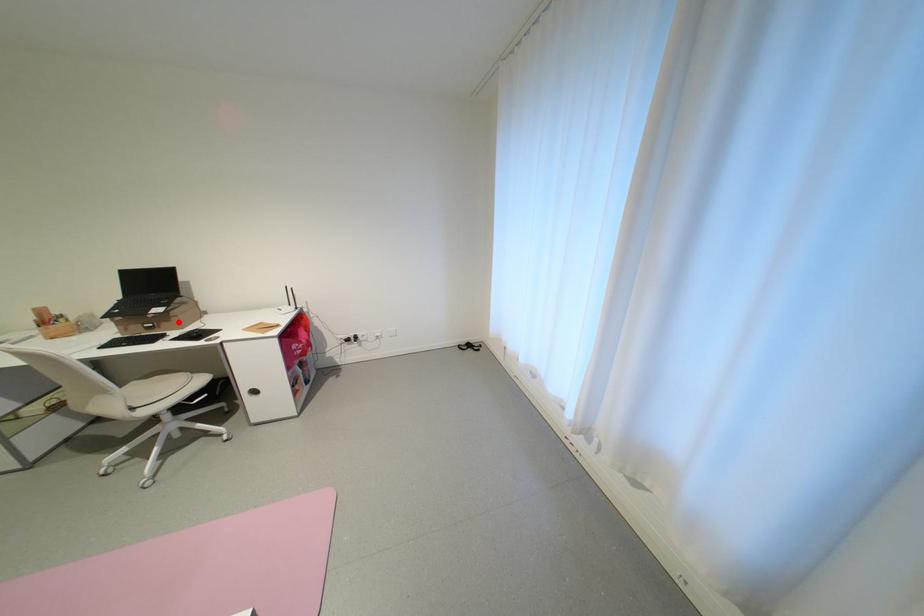
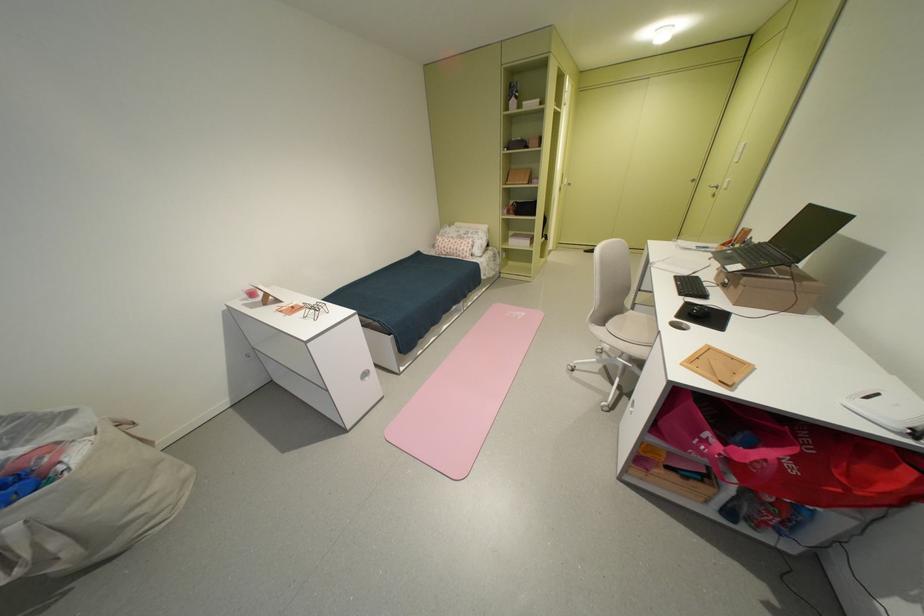
Locate, in the second image, the point that corresponds to the highlighted location in the first image.

(746, 288)